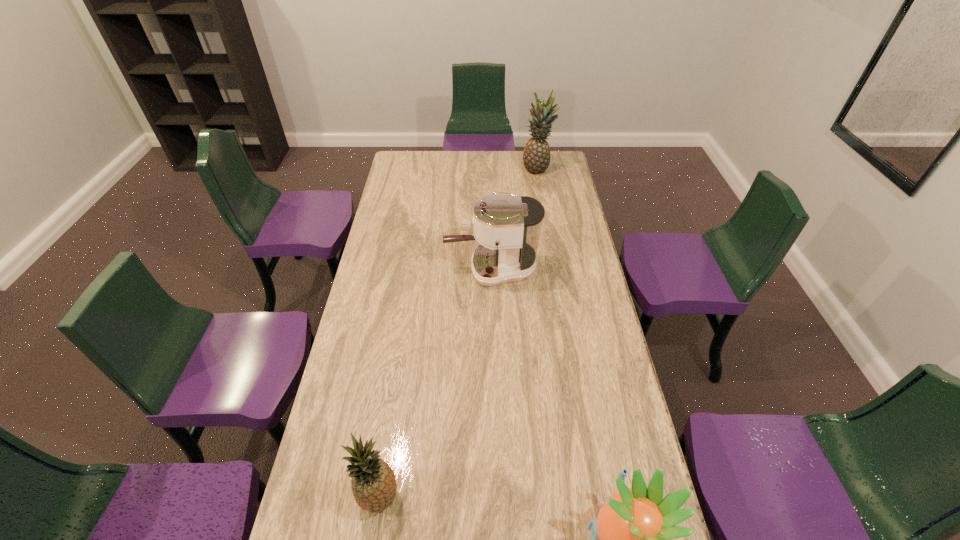
I want to click on object that stands as the second closest to the farthest pineapple, so click(631, 538).

Select which object appears as the closest to the farthest object. Please provide its 2D coordinates. Your answer should be formatted as a tuple, i.e. [(x, y)], where the tuple contains the x and y coordinates of a point satisfying the conditions above.

[(507, 227)]

This screenshot has width=960, height=540. I want to click on the third closest pineapple to the coffee maker, so click(631, 538).

The height and width of the screenshot is (540, 960). In order to click on pineapple identified as the second closest to the farthest object in this screenshot , I will do `click(374, 487)`.